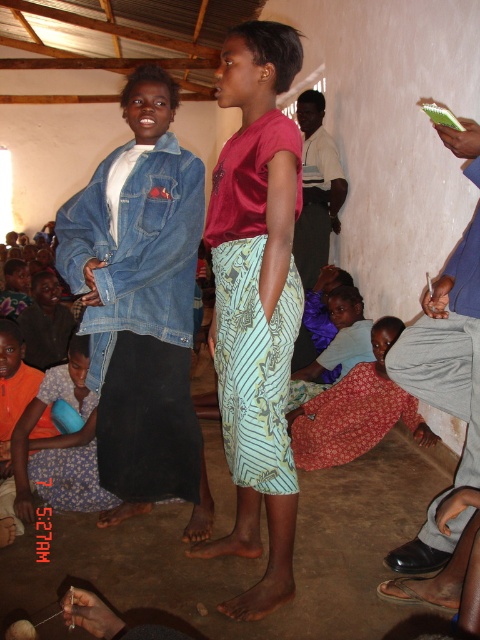
The image size is (480, 640). Find the location of `silky pink blouse at center`. silky pink blouse at center is located at coordinates (256, 301).

Between silky pink blouse at center and dark blue jeans at lower right, which one appears on the right side from the viewer's perspective?

dark blue jeans at lower right is more to the right.

In order to click on silky pink blouse at center in this screenshot , I will do `click(256, 301)`.

Which is behind, point (448, 284) or point (355, 449)?

Positioned behind is point (355, 449).

Is dark blue jeans at lower right in front of printed fabric dress at lower center?

That is True.

Who is more distant from viewer, (437, 588) or (331, 449)?

Answer: Point (331, 449)

At what (x,y) coordinates should I click in order to perform the action: click on dark blue jeans at lower right. Please return your answer as a coordinate pair (x, y). The height and width of the screenshot is (640, 480). Looking at the image, I should click on (447, 348).

Which is above, denim jacket at left or dark blue jeans at lower right?

denim jacket at left is above.

Is point (175, 490) positioned behind point (443, 326)?

Yes.

This screenshot has height=640, width=480. In order to click on denim jacket at left in this screenshot , I will do `click(142, 305)`.